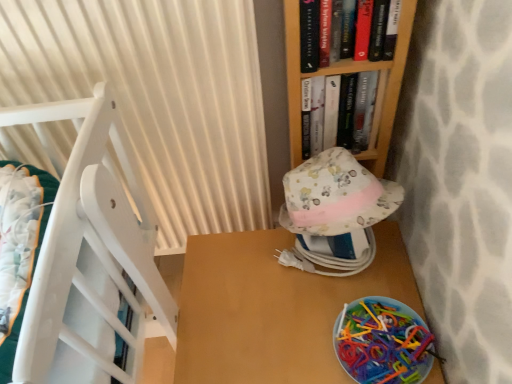
Question: From the image's perspective, is white pleated curtain at left located above hardcover book at upper center, which ranks as the 1th book in front-to-back order?

Choices:
 (A) no
 (B) yes

Answer: (A)

Question: From a real-world perspective, is white pleated curtain at left physically below hardcover book at upper center, which ranks as the 1th book in front-to-back order?

Choices:
 (A) no
 (B) yes

Answer: (B)

Question: From a real-world perspective, does white pleated curtain at left stand above hardcover book at upper center, which ranks as the 1th book in front-to-back order?

Choices:
 (A) no
 (B) yes

Answer: (A)

Question: Is white pleated curtain at left directly adjacent to hardcover book at upper center, the 2th book positioned from the back?

Choices:
 (A) no
 (B) yes

Answer: (A)

Question: Is white pleated curtain at left positioned with its back to hardcover book at upper center, which ranks as the 1th book in front-to-back order?

Choices:
 (A) no
 (B) yes

Answer: (A)

Question: Choose the correct answer: Is hardcover book at upper center, arranged as the 1th book when viewed from the back, inside translucent plastic toys at lower right or outside it?

Choices:
 (A) inside
 (B) outside

Answer: (B)

Question: Considering their positions, is hardcover book at upper center, which is the second book from front to back, located in front of or behind translucent plastic toys at lower right?

Choices:
 (A) behind
 (B) front

Answer: (A)

Question: Considering the positions of hardcover book at upper center, which is the second book from front to back, and translucent plastic toys at lower right in the image, is hardcover book at upper center, which is the second book from front to back, taller or shorter than translucent plastic toys at lower right?

Choices:
 (A) tall
 (B) short

Answer: (A)

Question: Based on their positions, is hardcover book at upper center, arranged as the 1th book when viewed from the back, located to the left or right of translucent plastic toys at lower right?

Choices:
 (A) right
 (B) left

Answer: (B)

Question: Does point (357, 97) appear closer or farther from the camera than point (301, 11)?

Choices:
 (A) farther
 (B) closer

Answer: (A)

Question: Would you say hardcover book at upper center, which is the second book from front to back, is to the left or to the right of hardcover book at upper center, the 2th book positioned from the back, in the picture?

Choices:
 (A) left
 (B) right

Answer: (B)

Question: Choose the correct answer: Is hardcover book at upper center, which is the second book from front to back, inside hardcover book at upper center, the 2th book positioned from the back, or outside it?

Choices:
 (A) inside
 (B) outside

Answer: (B)

Question: From the image's perspective, is hardcover book at upper center, which is the second book from front to back, positioned above or below hardcover book at upper center, which ranks as the 1th book in front-to-back order?

Choices:
 (A) below
 (B) above

Answer: (A)

Question: Is hardcover book at upper center, which is the second book from front to back, in front of or behind floral fabric hat at center in the image?

Choices:
 (A) front
 (B) behind

Answer: (B)

Question: From a real-world perspective, relative to floral fabric hat at center, is hardcover book at upper center, which is the second book from front to back, vertically above or below?

Choices:
 (A) above
 (B) below

Answer: (A)